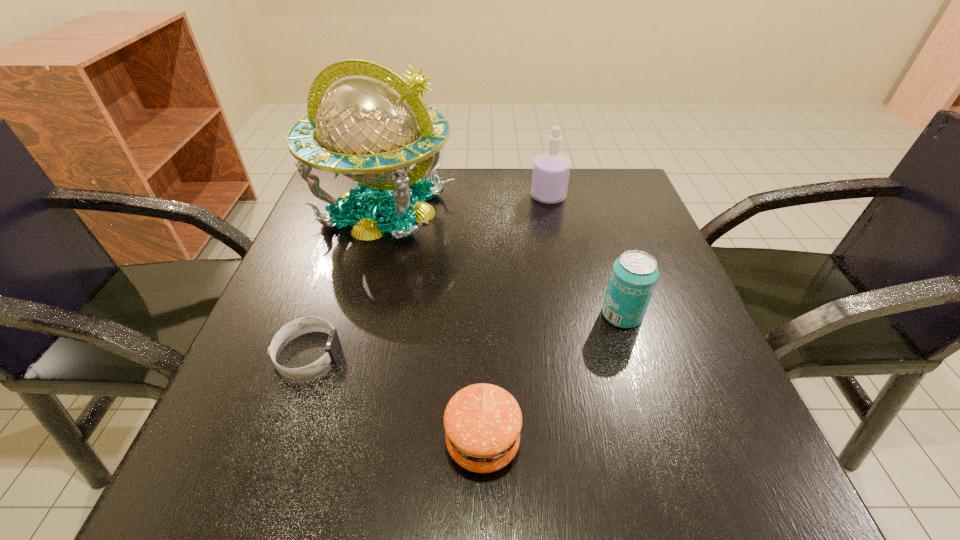
Find the location of `vacant area situated 0.200m on the back of the third tallest object`. vacant area situated 0.200m on the back of the third tallest object is located at coordinates (596, 233).

Locate an element on the screen. vacant space located 0.210m on the right of the nearest object is located at coordinates (674, 442).

Locate an element on the screen. This screenshot has width=960, height=540. vacant space positioned on the outer surface of the wristband is located at coordinates (425, 353).

This screenshot has height=540, width=960. In order to click on globe located at the far edge in this screenshot , I will do `click(372, 127)`.

Where is `perfume that is at the far edge`? perfume that is at the far edge is located at coordinates (551, 170).

At what (x,y) coordinates should I click in order to perform the action: click on object located at the near edge. Please return your answer as a coordinate pair (x, y). This screenshot has width=960, height=540. Looking at the image, I should click on (482, 422).

Where is `globe that is at the left edge`? Image resolution: width=960 pixels, height=540 pixels. globe that is at the left edge is located at coordinates (372, 127).

Locate an element on the screen. Image resolution: width=960 pixels, height=540 pixels. wristband that is at the left edge is located at coordinates (332, 347).

Identify the location of object that is at the right edge. This screenshot has height=540, width=960. point(634,274).

Image resolution: width=960 pixels, height=540 pixels. In order to click on object present at the far left corner in this screenshot , I will do `click(372, 127)`.